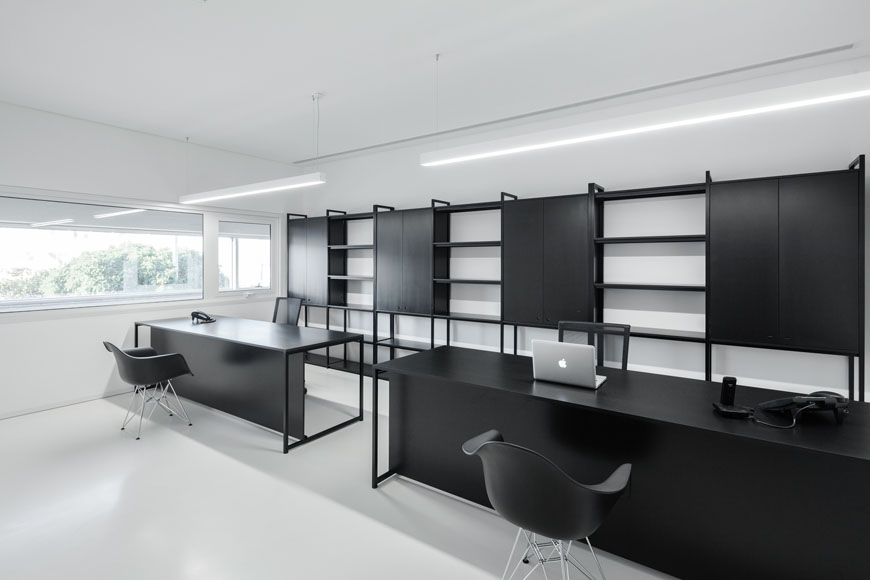
Where is `desk`? desk is located at coordinates pos(252,373).